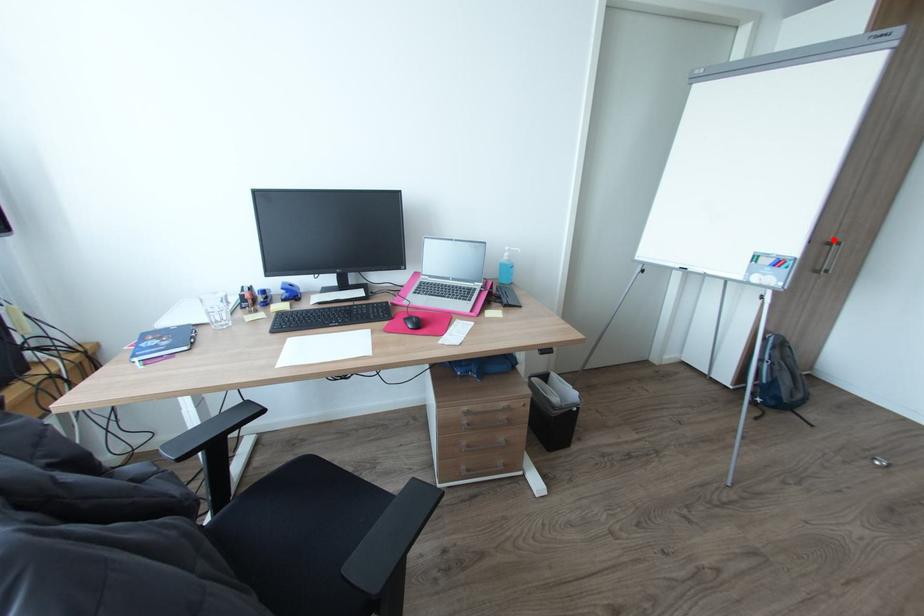
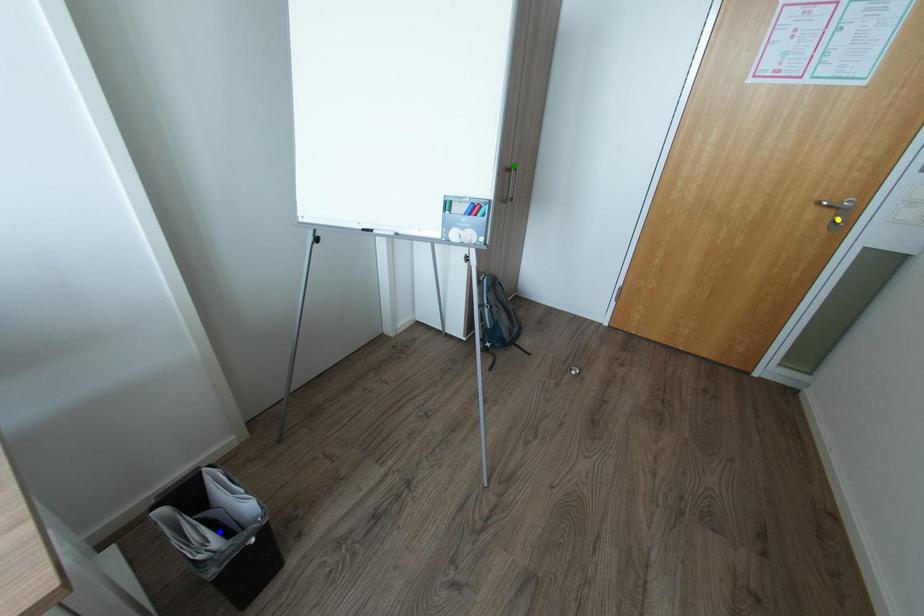
Question: I am providing you with two images of the same scene from different viewpoints. A red point is marked on the first image. You are given multiple points on the second image. Which spot in image 2 lines up with the point in image 1?

Choices:
 (A) green point
 (B) blue point
 (C) yellow point

Answer: (A)